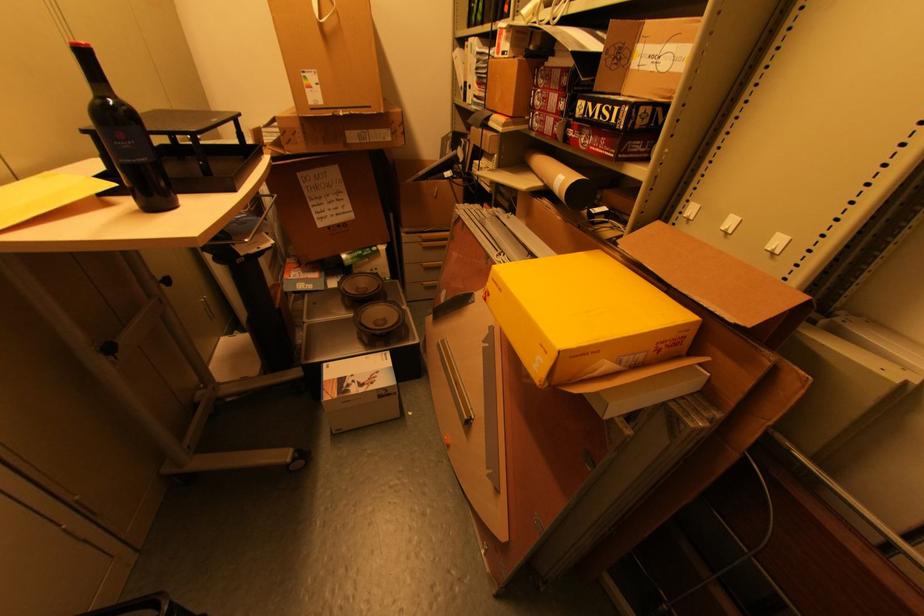
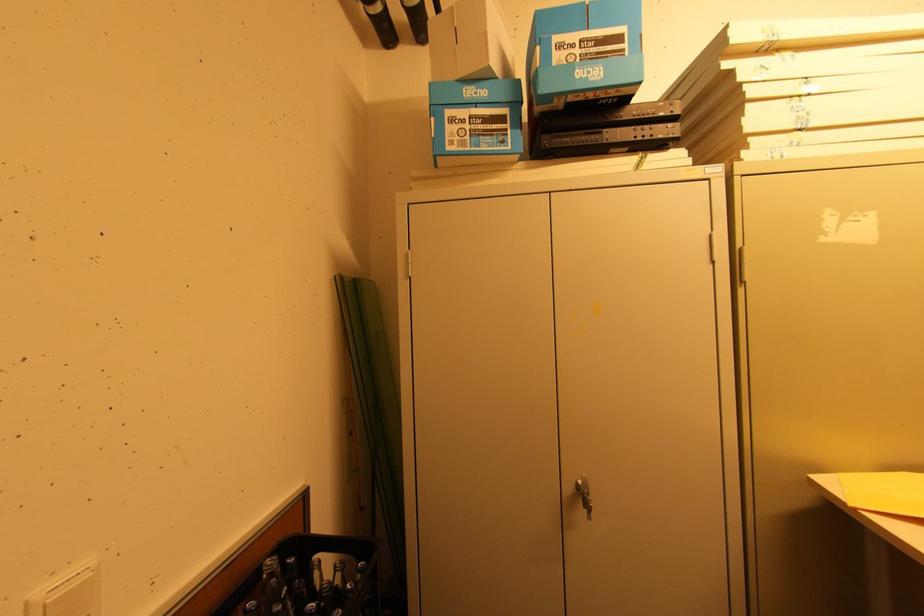
Question: The camera is either moving clockwise (left) or counter-clockwise (right) around the object. The first image is from the beginning of the video and the second image is from the end. Is the camera moving left or right when shooting the video?

Choices:
 (A) Left
 (B) Right

Answer: (B)